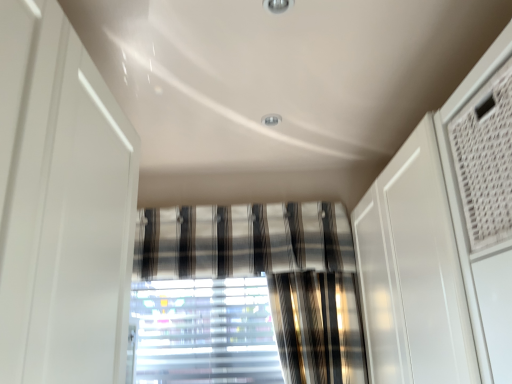
Question: In the image, is translucent plastic blinds at center positioned in front of or behind striped fabric curtain at center?

Choices:
 (A) front
 (B) behind

Answer: (B)

Question: In the image, is translucent plastic blinds at center on the left side or the right side of striped fabric curtain at center?

Choices:
 (A) right
 (B) left

Answer: (B)

Question: From a real-world perspective, is translucent plastic blinds at center positioned above or below striped fabric curtain at center?

Choices:
 (A) below
 (B) above

Answer: (A)

Question: Is striped fabric curtain at center taller or shorter than translucent plastic blinds at center?

Choices:
 (A) tall
 (B) short

Answer: (B)

Question: From the image's perspective, relative to translucent plastic blinds at center, is striped fabric curtain at center above or below?

Choices:
 (A) below
 (B) above

Answer: (B)

Question: Considering the positions of point (287, 258) and point (219, 380), is point (287, 258) closer or farther from the camera than point (219, 380)?

Choices:
 (A) farther
 (B) closer

Answer: (B)

Question: From a real-world perspective, is striped fabric curtain at center physically located above or below translucent plastic blinds at center?

Choices:
 (A) below
 (B) above

Answer: (B)